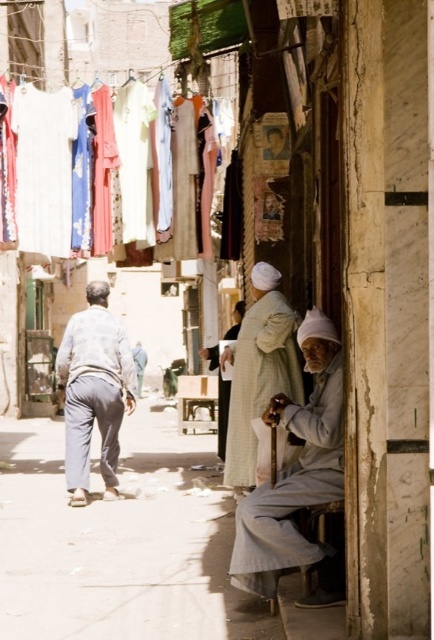
Question: Which of the following is the farthest from the observer?

Choices:
 (A) light gray cotton pants at center
 (B) light gray cotton robe at lower right
 (C) light beige fabric at center
 (D) floral fabric dresses at upper left

Answer: (D)

Question: Which is farther from the light beige fabric robe at center?

Choices:
 (A) light gray cotton robe at lower right
 (B) floral fabric dresses at upper left

Answer: (A)

Question: Does light gray cotton robe at lower right appear on the right side of light gray cotton pants at center?

Choices:
 (A) no
 (B) yes

Answer: (B)

Question: Considering the relative positions of light gray cotton robe at lower right and light gray cotton pants at center in the image provided, where is light gray cotton robe at lower right located with respect to light gray cotton pants at center?

Choices:
 (A) above
 (B) below

Answer: (A)

Question: Can you confirm if light gray cotton robe at lower right is positioned above light beige fabric at center?

Choices:
 (A) yes
 (B) no

Answer: (B)

Question: Which point is farther to the camera?

Choices:
 (A) floral fabric dresses at upper left
 (B) light beige fabric robe at center
 (C) light beige fabric at center

Answer: (A)